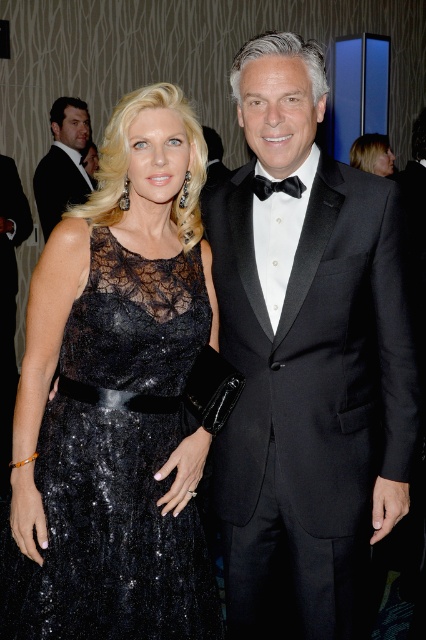
Between point (52, 177) and point (304, 188), which one is positioned in front?

Point (304, 188) is in front.

Locate an element on the screen. The height and width of the screenshot is (640, 426). matte black tuxedo at upper left is located at coordinates (63, 163).

You are a GUI agent. You are given a task and a screenshot of the screen. Output one action in this format:
    pyautogui.click(x=<x>, y=<y>)
    Task: Click on the matte black tuxedo at upper left
    The width and height of the screenshot is (426, 640).
    Given the screenshot: What is the action you would take?
    pyautogui.click(x=63, y=163)

Who is lower down, black satin tuxedo at center or satin black dress at upper center?

black satin tuxedo at center is lower down.

Image resolution: width=426 pixels, height=640 pixels. Identify the location of black satin tuxedo at center. (307, 355).

The image size is (426, 640). What do you see at coordinates (307, 355) in the screenshot?
I see `black satin tuxedo at center` at bounding box center [307, 355].

The width and height of the screenshot is (426, 640). Identify the location of black satin tuxedo at center. (307, 355).

Between point (175, 358) and point (359, 164), which one is positioned in front?

Positioned in front is point (175, 358).

From the picture: Which is more to the left, black sequined dress at center or satin black dress at upper center?

Positioned to the left is black sequined dress at center.

Between point (135, 380) and point (362, 156), which one is positioned in front?

Point (135, 380) is more forward.

The width and height of the screenshot is (426, 640). In order to click on black sequined dress at center in this screenshot , I will do `click(117, 465)`.